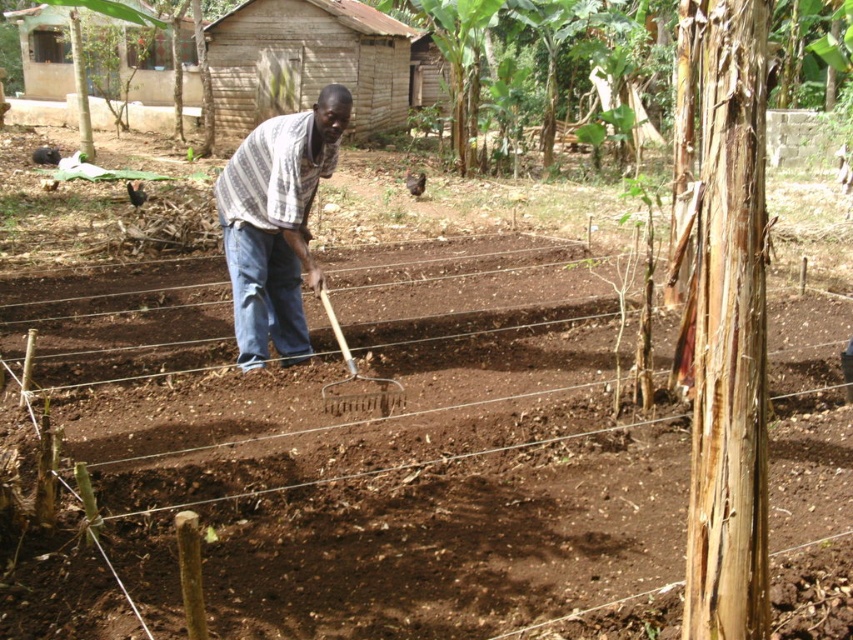
Does striped fabric shirt at center have a lesser height compared to wooden rake at center?

In fact, striped fabric shirt at center may be taller than wooden rake at center.

Looking at this image, is striped fabric shirt at center bigger than wooden rake at center?

Yes.

Is point (225, 166) positioned before point (350, 368)?

No, (225, 166) is further to viewer.

Identify the location of striped fabric shirt at center. This screenshot has height=640, width=853. (276, 224).